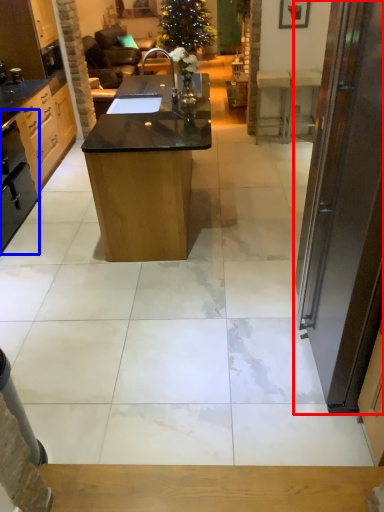
Question: Which object is closer to the camera taking this photo, door (highlighted by a red box) or appliance (highlighted by a blue box)?

Choices:
 (A) door
 (B) appliance

Answer: (A)